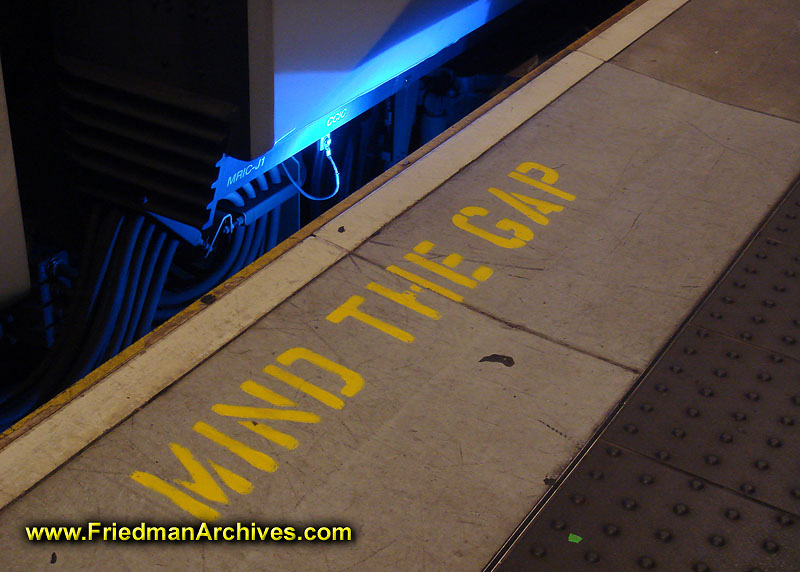
Identify the location of flooring with flowers. This screenshot has height=572, width=800. pos(654,507).